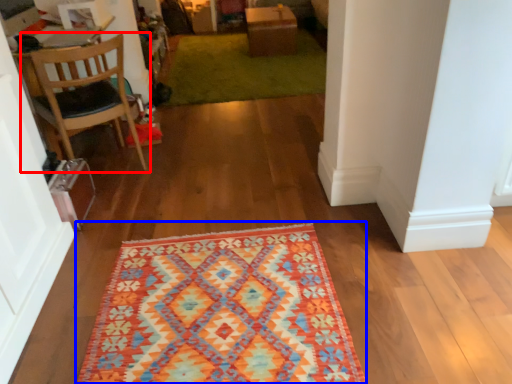
Question: Which object appears closest to the camera in this image, chair (highlighted by a red box) or mat (highlighted by a blue box)?

Choices:
 (A) chair
 (B) mat

Answer: (B)